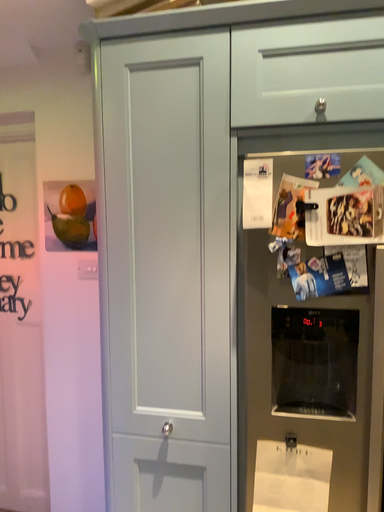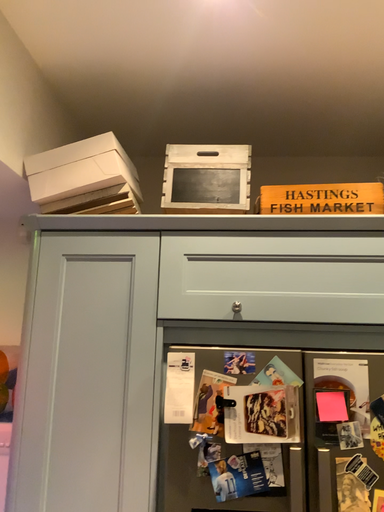
Question: Which way did the camera rotate in the video?

Choices:
 (A) rotated upward
 (B) rotated downward

Answer: (A)